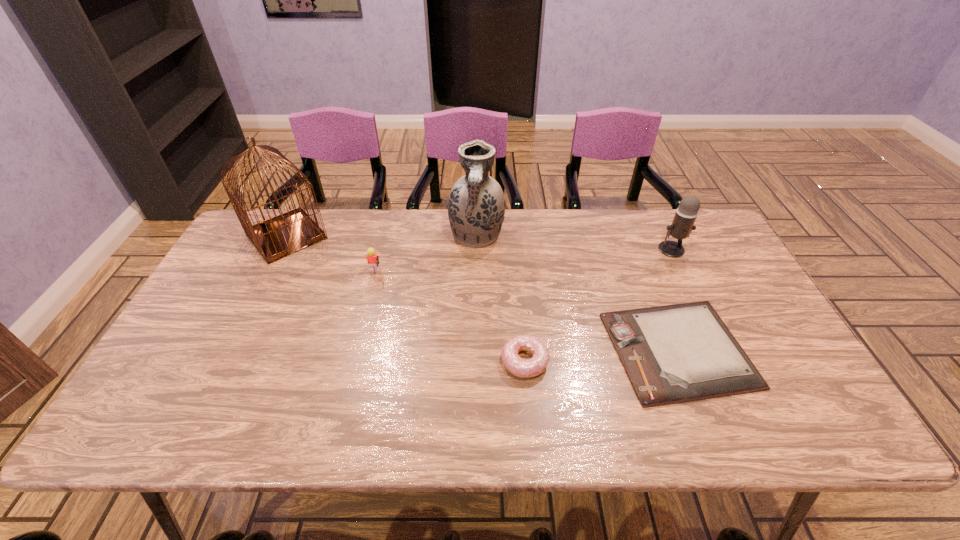
You are a GUI agent. You are given a task and a screenshot of the screen. Output one action in this format:
    pyautogui.click(x=<x>, y=<y>)
    Task: Click on the birdcage
    
    Given the screenshot: What is the action you would take?
    pyautogui.click(x=282, y=235)

Find the location of a particular element. The height and width of the screenshot is (540, 960). vase is located at coordinates (476, 205).

Locate an element on the screen. microphone is located at coordinates (682, 225).

I want to click on the fifth object from right to left, so click(372, 258).

This screenshot has width=960, height=540. Identify the location of the third shortest object. (372, 258).

You are a GUI agent. You are given a task and a screenshot of the screen. Output one action in this format:
    pyautogui.click(x=<x>, y=<y>)
    Task: Click on the doughnut
    The image size is (960, 540).
    Given the screenshot: What is the action you would take?
    pyautogui.click(x=525, y=368)

Image resolution: width=960 pixels, height=540 pixels. What are the coordinates of `clipboard` in the screenshot? It's located at (677, 353).

Locate an element on the screen. This screenshot has height=540, width=960. blank space located 0.280m on the right of the birdcage is located at coordinates (415, 236).

I want to click on free space located with the handle on the side of the vase, so click(x=476, y=276).

Where is `vacant area located on the right of the fourth shortest object`? This screenshot has width=960, height=540. vacant area located on the right of the fourth shortest object is located at coordinates (701, 249).